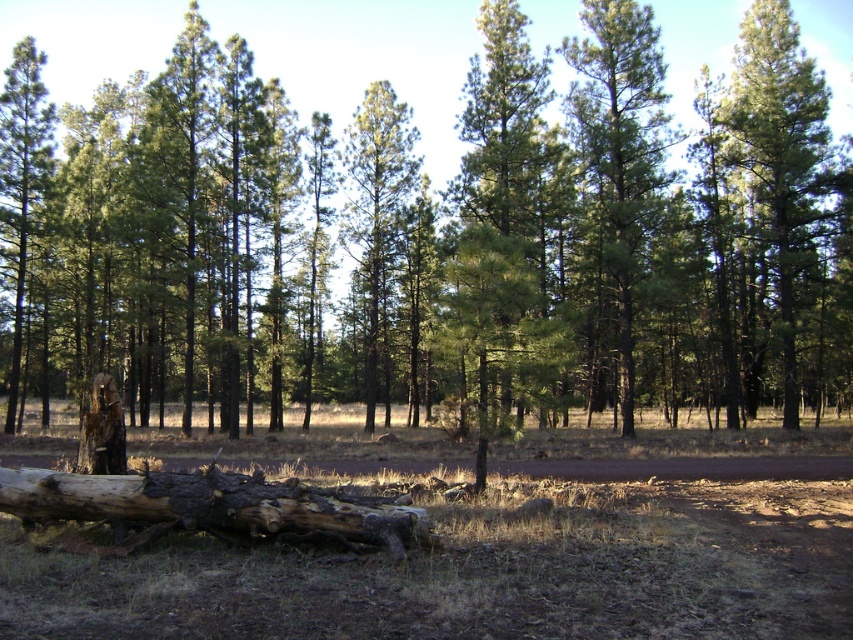
Question: Observing the image, what is the correct spatial positioning of green matte tree at center in reference to green matte tree at left?

Choices:
 (A) left
 (B) right

Answer: (B)

Question: Which of the following is the closest to the observer?

Choices:
 (A) green needle-like tree at center
 (B) green needle-like at center
 (C) weathered brown log at lower center

Answer: (C)

Question: Which of the following is the closest to the observer?

Choices:
 (A) green matte tree at upper right
 (B) green needle-like at center

Answer: (B)

Question: Which of the following is the closest to the observer?

Choices:
 (A) green matte tree at center
 (B) green needle-like tree at center

Answer: (A)

Question: Is green matte tree at upper right smaller than weathered brown log at lower center?

Choices:
 (A) no
 (B) yes

Answer: (A)

Question: Can you confirm if green needle-like tree at center is wider than charred wood stump at lower left?

Choices:
 (A) yes
 (B) no

Answer: (A)